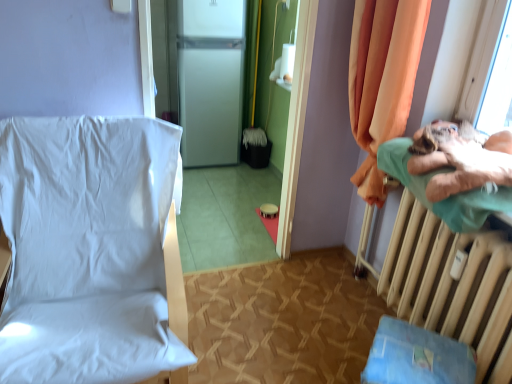
Question: Can you confirm if green fabric pillow at right is positioned to the left of white matte refrigerator at center?

Choices:
 (A) no
 (B) yes

Answer: (A)

Question: Is green fabric pillow at right positioned far away from white matte refrigerator at center?

Choices:
 (A) yes
 (B) no

Answer: (A)

Question: Is green fabric pillow at right bigger than white matte refrigerator at center?

Choices:
 (A) no
 (B) yes

Answer: (A)

Question: Would you say white matte refrigerator at center is part of green fabric pillow at right's contents?

Choices:
 (A) yes
 (B) no

Answer: (B)

Question: Is green fabric pillow at right at the right side of white matte refrigerator at center?

Choices:
 (A) yes
 (B) no

Answer: (A)

Question: From their relative heights in the image, would you say white matte refrigerator at center is taller or shorter than blue fabric changing table at lower right?

Choices:
 (A) tall
 (B) short

Answer: (A)

Question: Looking at the image, does white matte refrigerator at center seem bigger or smaller compared to blue fabric changing table at lower right?

Choices:
 (A) big
 (B) small

Answer: (A)

Question: In the image, is white matte refrigerator at center positioned in front of or behind blue fabric changing table at lower right?

Choices:
 (A) front
 (B) behind

Answer: (B)

Question: Would you say white matte refrigerator at center is to the left or to the right of blue fabric changing table at lower right in the picture?

Choices:
 (A) left
 (B) right

Answer: (A)

Question: Considering the positions of orange fabric curtain at right and white matte refrigerator at center in the image, is orange fabric curtain at right taller or shorter than white matte refrigerator at center?

Choices:
 (A) tall
 (B) short

Answer: (B)

Question: Is orange fabric curtain at right in front of or behind white matte refrigerator at center in the image?

Choices:
 (A) front
 (B) behind

Answer: (A)

Question: In the image, is orange fabric curtain at right on the left side or the right side of white matte refrigerator at center?

Choices:
 (A) left
 (B) right

Answer: (B)

Question: From the image's perspective, is orange fabric curtain at right above or below white matte refrigerator at center?

Choices:
 (A) above
 (B) below

Answer: (B)

Question: From a real-world perspective, relative to blue fabric changing table at lower right, is orange fabric curtain at right vertically above or below?

Choices:
 (A) above
 (B) below

Answer: (A)

Question: Considering the relative positions of orange fabric curtain at right and blue fabric changing table at lower right in the image provided, is orange fabric curtain at right to the left or to the right of blue fabric changing table at lower right?

Choices:
 (A) right
 (B) left

Answer: (A)